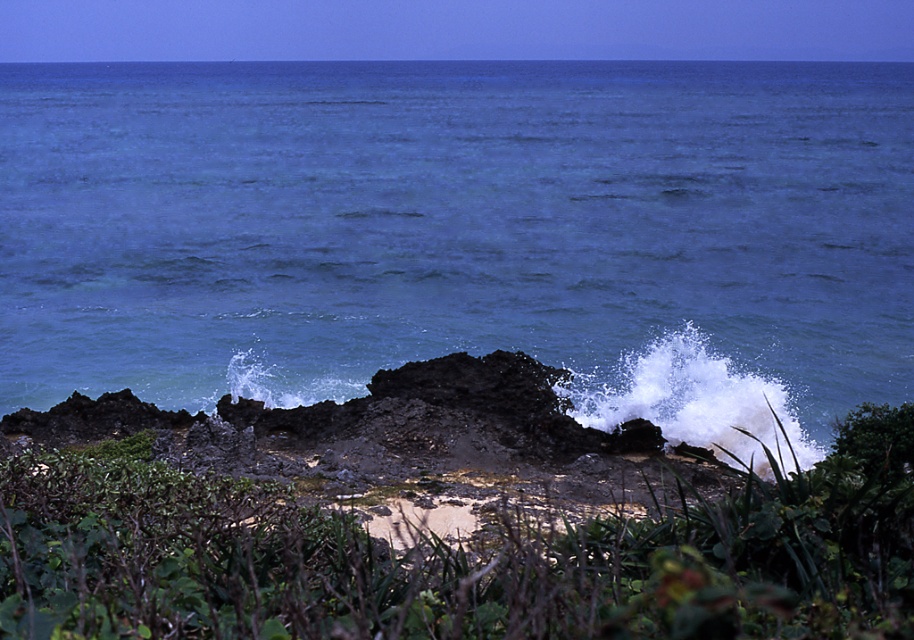
Find the location of a particular element. blue water at center is located at coordinates (463, 234).

Does blue water at center appear over green leafy vegetation at center?

Indeed, blue water at center is positioned over green leafy vegetation at center.

Which is in front, point (760, 204) or point (29, 525)?

Point (29, 525)

Locate an element on the screen. blue water at center is located at coordinates (463, 234).